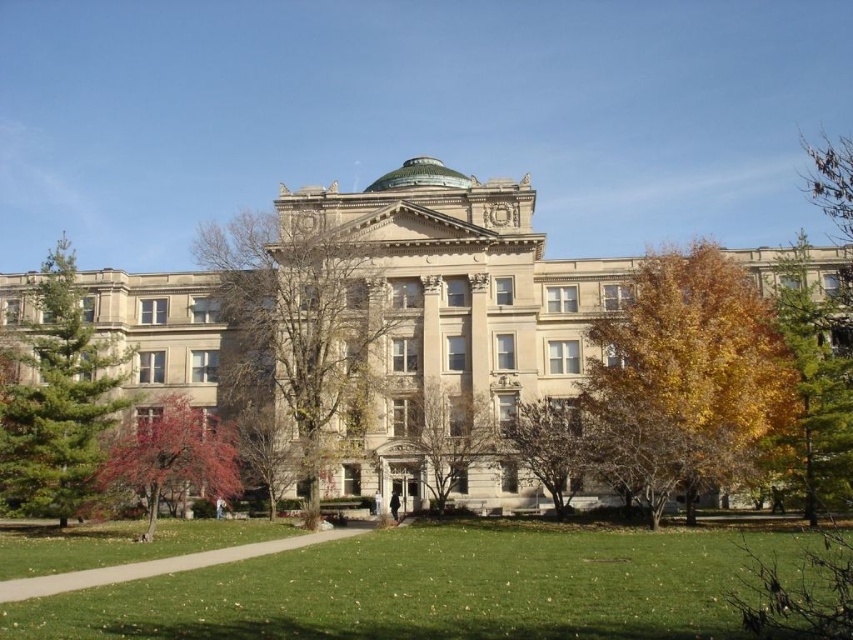
You are planning to plant a new tree in the courtyard of the classical building. You have two options based on the image provided. Which tree, the smooth gray tree at center or the green leafy tree at right, would require more space due to its size?

The smooth gray tree at center is larger in size than the green leafy tree at right, so it would require more space.